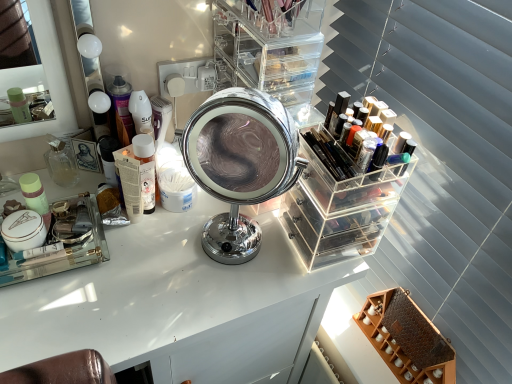
What are the coordinates of `vacant space in front of chrome/metallic mirror at center` in the screenshot? It's located at (198, 304).